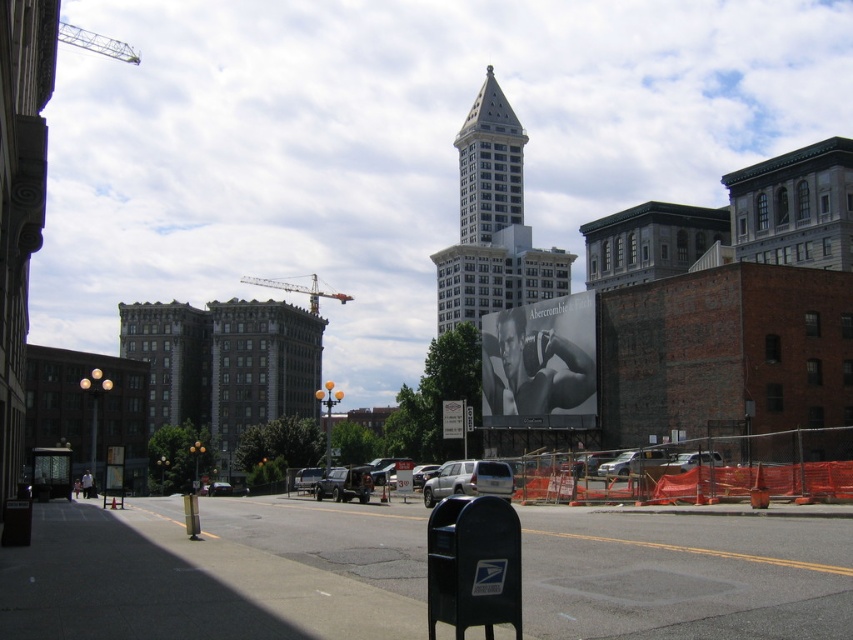
You are standing on the sidewalk near the black USPS mailbox at lower center right and looking towards the center of the image. Which tower, the white stone tower at center or the white glass tower at center, is closer to you?

The white stone tower at center is closer to you because it is located below the white glass tower at center, meaning it is positioned lower in the visual field and thus nearer in the scene.